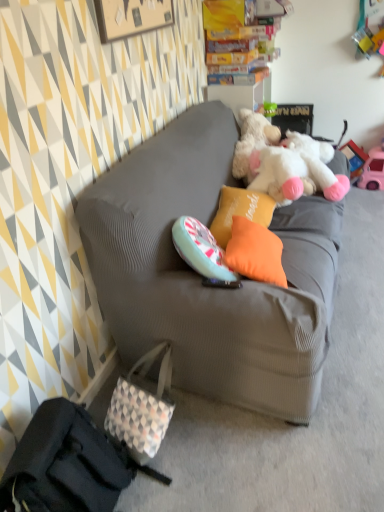
Identify the location of orange fabric pillow at center, placed as the second pillow when sorted from front to back. (240, 211).

The width and height of the screenshot is (384, 512). I want to click on white checkered fabric handbag at lower left, which appears as the first handbag when viewed from the front, so click(x=67, y=464).

Locate an element on the screen. This screenshot has height=512, width=384. pink plastic toy car at right is located at coordinates (373, 170).

In order to face orange fabric pillow at center, which ranks as the 2th pillow in back-to-front order, should I rotate leftwards or rightwards?

It's best to rotate right around 8.784 degrees.

Find the location of a particular element. Image resolution: width=384 pixels, height=512 pixels. gray fabric couch at center is located at coordinates (200, 277).

This screenshot has width=384, height=512. Identify the location of white fluffy teddy bear at upper right. (284, 162).

Where is `white checkered fabric handbag at lower left, the first handbag when ordered from back to front`? white checkered fabric handbag at lower left, the first handbag when ordered from back to front is located at coordinates (142, 407).

Is gray fabric couch at center inside or outside of orange fabric pillow at center, the first pillow in the front-to-back sequence?

gray fabric couch at center is spatially situated outside orange fabric pillow at center, the first pillow in the front-to-back sequence.

Is gray fabric couch at center not near orange fabric pillow at center, which ranks as the 2th pillow in back-to-front order?

No.

This screenshot has width=384, height=512. In order to click on studio couch below the orange fabric pillow at center, the first pillow in the front-to-back sequence (from a real-world perspective) in this screenshot , I will do `click(200, 277)`.

Is gray fabric couch at center to the left of orange fabric pillow at center, the first pillow in the front-to-back sequence, from the viewer's perspective?

No, gray fabric couch at center is not to the left of orange fabric pillow at center, the first pillow in the front-to-back sequence.

Locate an element on the screen. Image resolution: width=384 pixels, height=512 pixels. the 2nd handbag counting from the left of the orange fabric pillow at center, the first pillow in the front-to-back sequence is located at coordinates (67, 464).

From the image's perspective, which one is positioned lower, white checkered fabric handbag at lower left, the second handbag positioned from the back, or orange fabric pillow at center, which ranks as the 2th pillow in back-to-front order?

white checkered fabric handbag at lower left, the second handbag positioned from the back, is shown below in the image.

Is white checkered fabric handbag at lower left, the second handbag positioned from the back, not close to orange fabric pillow at center, the first pillow in the front-to-back sequence?

A: They are positioned close to each other.

Is white checkered fabric handbag at lower left, the second handbag positioned from the back, oriented away from orange fabric pillow at center, the first pillow in the front-to-back sequence?

No.

From a real-world perspective, between pink plastic toy car at right and orange fabric pillow at center, which ranks as the 2th pillow in back-to-front order, who is vertically lower?

From a 3D spatial view, pink plastic toy car at right is below.

Is pink plastic toy car at right at the right side of orange fabric pillow at center, the first pillow in the front-to-back sequence?

Correct, you'll find pink plastic toy car at right to the right of orange fabric pillow at center, the first pillow in the front-to-back sequence.

In terms of width, does pink plastic toy car at right look wider or thinner when compared to orange fabric pillow at center, the first pillow in the front-to-back sequence?

pink plastic toy car at right is wider than orange fabric pillow at center, the first pillow in the front-to-back sequence.

Is point (219, 231) farther from camera compared to point (15, 463)?

Yes, it is.

Is orange fabric pillow at center, placed as the second pillow when sorted from front to back, in front of white checkered fabric handbag at lower left, which appears as the first handbag when viewed from the front?

No, orange fabric pillow at center, placed as the second pillow when sorted from front to back, is further to the viewer.

Is orange fabric pillow at center, the 1th pillow viewed from the back, facing towards white checkered fabric handbag at lower left, the second handbag positioned from the back?

No, orange fabric pillow at center, the 1th pillow viewed from the back, does not turn towards white checkered fabric handbag at lower left, the second handbag positioned from the back.

Which is more to the right, orange fabric pillow at center, the 1th pillow viewed from the back, or white checkered fabric handbag at lower left, which appears as the first handbag when viewed from the front?

orange fabric pillow at center, the 1th pillow viewed from the back, is more to the right.

Between white fluffy teddy bear at upper right and white checkered fabric handbag at lower left, the first handbag when ordered from back to front, which one has smaller size?

white checkered fabric handbag at lower left, the first handbag when ordered from back to front.

In terms of height, does white fluffy teddy bear at upper right look taller or shorter compared to white checkered fabric handbag at lower left, the first handbag when ordered from back to front?

Clearly, white fluffy teddy bear at upper right is shorter compared to white checkered fabric handbag at lower left, the first handbag when ordered from back to front.

In the scene shown: Is the depth of white fluffy teddy bear at upper right less than that of white checkered fabric handbag at lower left, the first handbag when ordered from back to front?

No, it is not.

Based on the photo, is white checkered fabric handbag at lower left, the second handbag positioned from the back, further to the viewer compared to gray fabric couch at center?

No, it is in front of gray fabric couch at center.

There is a gray fabric couch at center. Find the location of `the 1st handbag below it (from a real-world perspective)`. the 1st handbag below it (from a real-world perspective) is located at coordinates [x=67, y=464].

From the picture: Considering the sizes of objects white checkered fabric handbag at lower left, which appears as the first handbag when viewed from the front, and gray fabric couch at center in the image provided, who is wider, white checkered fabric handbag at lower left, which appears as the first handbag when viewed from the front, or gray fabric couch at center?

gray fabric couch at center.

Is white checkered fabric handbag at lower left, the second handbag positioned from the back, completely or partially outside of gray fabric couch at center?

white checkered fabric handbag at lower left, the second handbag positioned from the back, is positioned outside gray fabric couch at center.

From the image's perspective, is white fluffy teddy bear at upper right over white checkered fabric handbag at lower left, the second handbag positioned from the back?

Correct, white fluffy teddy bear at upper right appears higher than white checkered fabric handbag at lower left, the second handbag positioned from the back, in the image.

Is white fluffy teddy bear at upper right at the left side of white checkered fabric handbag at lower left, which appears as the first handbag when viewed from the front?

No.

Image resolution: width=384 pixels, height=512 pixels. What are the coordinates of `teddy bear behind the white checkered fabric handbag at lower left, which appears as the first handbag when viewed from the front` in the screenshot? It's located at (284, 162).

This screenshot has width=384, height=512. Find the location of `studio couch on the right side of orange fabric pillow at center, which ranks as the 2th pillow in back-to-front order`. studio couch on the right side of orange fabric pillow at center, which ranks as the 2th pillow in back-to-front order is located at coordinates (200, 277).

Starting from the orange fabric pillow at center, which ranks as the 2th pillow in back-to-front order, which handbag is the 2nd one to the left? Please provide its 2D coordinates.

[(67, 464)]

Estimate the real-world distances between objects in this image. Which object is closer to gray fabric couch at center, white checkered fabric handbag at lower left, the second handbag positioned from the back, or white fluffy teddy bear at upper right?

white fluffy teddy bear at upper right is positioned closer to the anchor gray fabric couch at center.

Estimate the real-world distances between objects in this image. Which object is further from pink plastic toy car at right, white checkered fabric handbag at lower left, the 2th handbag viewed from the front, or white checkered fabric handbag at lower left, the second handbag positioned from the back?

Based on the image, white checkered fabric handbag at lower left, the second handbag positioned from the back, appears to be further to pink plastic toy car at right.

Based on their spatial positions, is gray fabric couch at center or white checkered fabric handbag at lower left, which appears as the first handbag when viewed from the front, closer to white checkered fabric handbag at lower left, the 2th handbag viewed from the front?

white checkered fabric handbag at lower left, which appears as the first handbag when viewed from the front, is closer to white checkered fabric handbag at lower left, the 2th handbag viewed from the front.

From the image, which object appears to be farther from orange fabric pillow at center, placed as the second pillow when sorted from front to back, gray fabric couch at center or orange fabric pillow at center, the first pillow in the front-to-back sequence?

Based on the image, gray fabric couch at center appears to be further to orange fabric pillow at center, placed as the second pillow when sorted from front to back.

From the image, which object appears to be farther from white checkered fabric handbag at lower left, the second handbag positioned from the back, white fluffy teddy bear at upper right or gray fabric couch at center?

white fluffy teddy bear at upper right lies further to white checkered fabric handbag at lower left, the second handbag positioned from the back, than the other object.

Estimate the real-world distances between objects in this image. Which object is closer to gray fabric couch at center, orange fabric pillow at center, the first pillow in the front-to-back sequence, or white checkered fabric handbag at lower left, the first handbag when ordered from back to front?

orange fabric pillow at center, the first pillow in the front-to-back sequence, is closer to gray fabric couch at center.

Looking at this image, considering their positions, is orange fabric pillow at center, which ranks as the 2th pillow in back-to-front order, positioned closer to white checkered fabric handbag at lower left, the second handbag positioned from the back, than white fluffy teddy bear at upper right?

orange fabric pillow at center, which ranks as the 2th pillow in back-to-front order, is closer to white checkered fabric handbag at lower left, the second handbag positioned from the back.

Estimate the real-world distances between objects in this image. Which object is further from orange fabric pillow at center, placed as the second pillow when sorted from front to back, white fluffy teddy bear at upper right or white checkered fabric handbag at lower left, the second handbag positioned from the back?

The object further to orange fabric pillow at center, placed as the second pillow when sorted from front to back, is white checkered fabric handbag at lower left, the second handbag positioned from the back.

Where is `handbag located between gray fabric couch at center and pink plastic toy car at right in the depth direction`? This screenshot has width=384, height=512. handbag located between gray fabric couch at center and pink plastic toy car at right in the depth direction is located at coordinates (142, 407).

You are a GUI agent. You are given a task and a screenshot of the screen. Output one action in this format:
    pyautogui.click(x=<x>, y=<y>)
    Task: Click on the studio couch between white fluffy teddy bear at upper right and white checkered fabric handbag at lower left, the second handbag positioned from the back, in the up-down direction
    This screenshot has width=384, height=512.
    Given the screenshot: What is the action you would take?
    pyautogui.click(x=200, y=277)

Image resolution: width=384 pixels, height=512 pixels. I want to click on pillow between orange fabric pillow at center, placed as the second pillow when sorted from front to back, and white checkered fabric handbag at lower left, the 2th handbag viewed from the front, in the up-down direction, so click(x=255, y=252).

Identify the location of pillow that lies between orange fabric pillow at center, the 1th pillow viewed from the back, and white checkered fabric handbag at lower left, the second handbag positioned from the back, from top to bottom. (255, 252).